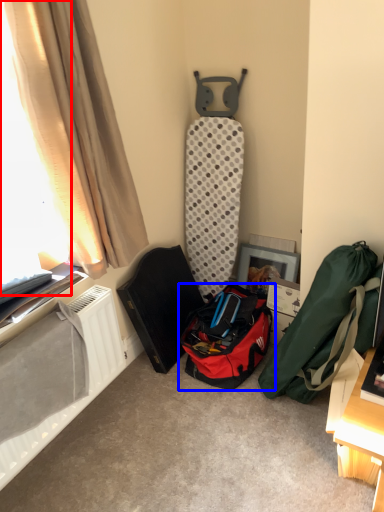
Question: Among these objects, which one is farthest to the camera, window screen (highlighted by a red box) or luggage and bags (highlighted by a blue box)?

Choices:
 (A) window screen
 (B) luggage and bags

Answer: (B)